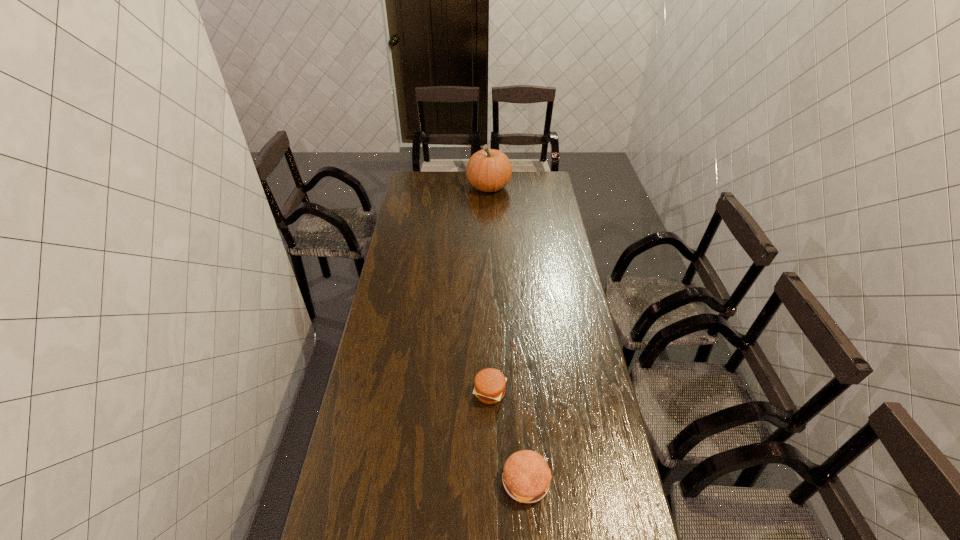
Locate an element on the screen. the farthest object is located at coordinates (488, 170).

I want to click on the tallest object, so click(x=488, y=170).

Locate an element on the screen. The width and height of the screenshot is (960, 540). the nearer hamburger is located at coordinates (526, 477).

I want to click on the second nearest object, so click(490, 383).

Identify the location of free space located 0.270m on the stem of the pumpkin. The image size is (960, 540). (417, 187).

This screenshot has height=540, width=960. What are the coordinates of `free space located on the stem of the pumpkin` in the screenshot? It's located at (425, 187).

Find the location of a particular element. This screenshot has height=540, width=960. free location located 0.200m on the stem of the pumpkin is located at coordinates (429, 187).

The width and height of the screenshot is (960, 540). I want to click on vacant region located 0.240m on the back of the nearest object, so click(519, 387).

Locate an element on the screen. The image size is (960, 540). blank space located 0.160m on the back of the second nearest object is located at coordinates (489, 341).

At what (x,y) coordinates should I click in order to perform the action: click on object positioned at the far edge. Please return your answer as a coordinate pair (x, y). This screenshot has width=960, height=540. Looking at the image, I should click on (488, 170).